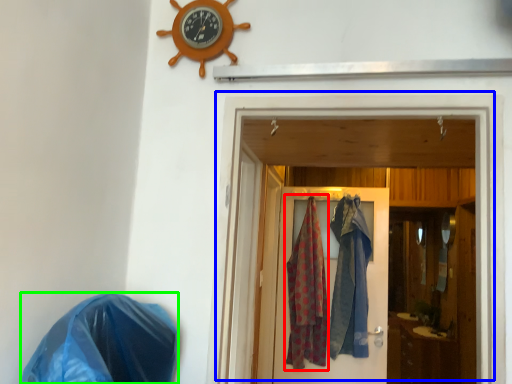
Question: Which object is positioned closest to clothing (highlighted by a red box)? Select from door (highlighted by a blue box) and material (highlighted by a green box).

Choices:
 (A) door
 (B) material

Answer: (A)